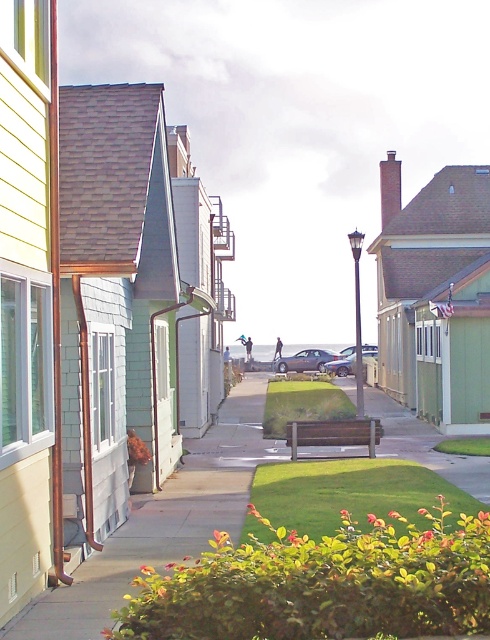
Does point (309, 355) come in front of point (363, 355)?

No, it is behind (363, 355).

Between satin silver sedan at center and metallic silver sedan at center, which one appears on the right side from the viewer's perspective?

Positioned to the right is metallic silver sedan at center.

This screenshot has height=640, width=490. I want to click on satin silver sedan at center, so click(305, 360).

Can you confirm if concrete sidewalk at center is taller than satin silver sedan at center?

Incorrect, concrete sidewalk at center's height is not larger of satin silver sedan at center's.

Who is shorter, concrete sidewalk at center or satin silver sedan at center?

Standing shorter between the two is concrete sidewalk at center.

Is point (93, 577) closer to viewer compared to point (303, 369)?

That is True.

The width and height of the screenshot is (490, 640). In order to click on concrete sidewalk at center in this screenshot , I will do `click(163, 522)`.

Between concrete sidewalk at center and metallic silver sedan at center, which one appears on the right side from the viewer's perspective?

Positioned to the right is metallic silver sedan at center.

Which is above, concrete sidewalk at center or metallic silver sedan at center?

Positioned higher is metallic silver sedan at center.

Which is behind, point (364, 448) or point (340, 364)?

Point (340, 364)

Where is `concrete sidewalk at center`? concrete sidewalk at center is located at coordinates (163, 522).